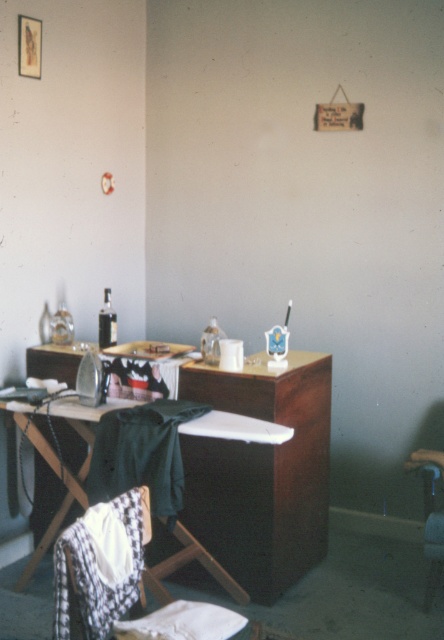
Is white knitted cloth at lower left smaller than wooden ironing board at center?

Correct, white knitted cloth at lower left occupies less space than wooden ironing board at center.

Who is more forward, (91, 576) or (189, 435)?

Point (91, 576) is more forward.

Find the location of a particular element. Image resolution: width=444 pixels, height=640 pixels. white knitted cloth at lower left is located at coordinates (100, 564).

Image resolution: width=444 pixels, height=640 pixels. I want to click on white knitted cloth at lower left, so click(100, 564).

Does point (122, 580) come behind point (145, 422)?

No.

Between point (78, 573) and point (122, 452), which one is positioned behind?

Point (122, 452)

In order to click on white knitted cloth at lower left in this screenshot , I will do `click(100, 564)`.

Where is `white knitted cloth at lower left`? white knitted cloth at lower left is located at coordinates (100, 564).

From the picture: Who is positioned more to the left, wooden ironing board at center or white cotton cloth at lower center?

wooden ironing board at center

Can you confirm if wooden ironing board at center is taller than white cotton cloth at lower center?

Yes, wooden ironing board at center is taller than white cotton cloth at lower center.

The width and height of the screenshot is (444, 640). I want to click on wooden ironing board at center, so click(x=63, y=483).